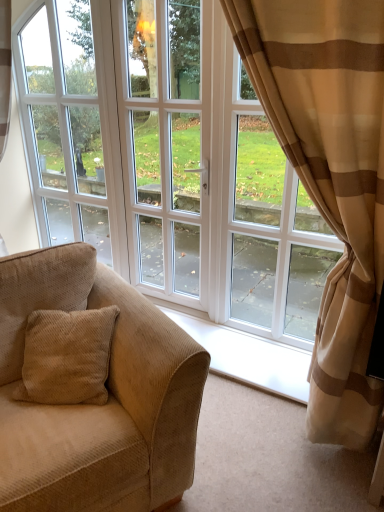
Question: Is white glossy door at center further to camera compared to beige corduroy couch at left?

Choices:
 (A) no
 (B) yes

Answer: (B)

Question: Can you confirm if white glossy door at center is shorter than beige corduroy couch at left?

Choices:
 (A) no
 (B) yes

Answer: (A)

Question: Is white glossy door at center positioned beyond the bounds of beige corduroy couch at left?

Choices:
 (A) yes
 (B) no

Answer: (A)

Question: Is white glossy door at center with beige corduroy couch at left?

Choices:
 (A) no
 (B) yes

Answer: (A)

Question: Could you tell me if white glossy door at center is turned towards beige corduroy couch at left?

Choices:
 (A) yes
 (B) no

Answer: (A)

Question: Which is correct: beige corduroy couch at left is inside white glossy door at center, or outside of it?

Choices:
 (A) outside
 (B) inside

Answer: (A)

Question: From their relative heights in the image, would you say beige corduroy couch at left is taller or shorter than white glossy door at center?

Choices:
 (A) short
 (B) tall

Answer: (A)

Question: From the image's perspective, is beige corduroy couch at left located above or below white glossy door at center?

Choices:
 (A) below
 (B) above

Answer: (A)

Question: Considering their positions, is beige corduroy couch at left located in front of or behind white glossy door at center?

Choices:
 (A) front
 (B) behind

Answer: (A)

Question: In the image, is beige corduroy couch at left positioned in front of or behind white glass window at center?

Choices:
 (A) front
 (B) behind

Answer: (A)

Question: From a real-world perspective, relative to white glass window at center, is beige corduroy couch at left vertically above or below?

Choices:
 (A) below
 (B) above

Answer: (A)

Question: In terms of width, does beige corduroy couch at left look wider or thinner when compared to white glass window at center?

Choices:
 (A) wide
 (B) thin

Answer: (A)

Question: Considering the positions of point [110, 494] and point [64, 51], is point [110, 494] closer or farther from the camera than point [64, 51]?

Choices:
 (A) closer
 (B) farther

Answer: (A)

Question: Considering the positions of beige striped curtain at right and beige corduroy couch at left in the image, is beige striped curtain at right taller or shorter than beige corduroy couch at left?

Choices:
 (A) tall
 (B) short

Answer: (A)

Question: Is beige striped curtain at right in front of or behind beige corduroy couch at left in the image?

Choices:
 (A) front
 (B) behind

Answer: (B)